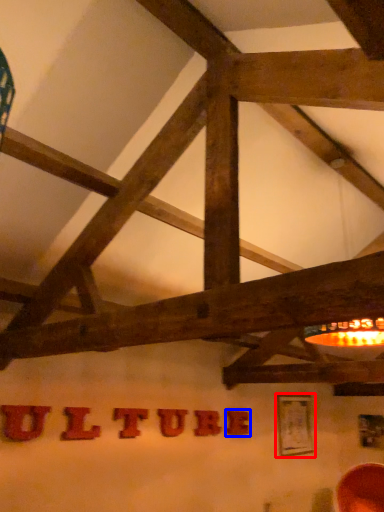
Question: Which object appears closest to the camera in this image, picture frame (highlighted by a red box) or letter (highlighted by a blue box)?

Choices:
 (A) picture frame
 (B) letter

Answer: (B)